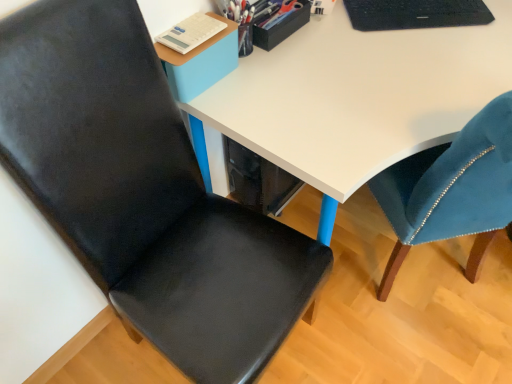
Question: Is point (359, 51) positioned closer to the camera than point (271, 38)?

Choices:
 (A) farther
 (B) closer

Answer: (A)

Question: Is white glossy desk at center to the left or to the right of metallic pen holder at upper center in the image?

Choices:
 (A) left
 (B) right

Answer: (B)

Question: Which object is the closest to the metallic pen holder at upper center?

Choices:
 (A) matte black chair at left
 (B) white glossy desk at center
 (C) black textured laptop at upper right

Answer: (B)

Question: Based on their relative distances, which object is nearer to the matte black chair at left?

Choices:
 (A) metallic pen holder at upper center
 (B) white glossy desk at center
 (C) black textured laptop at upper right

Answer: (B)